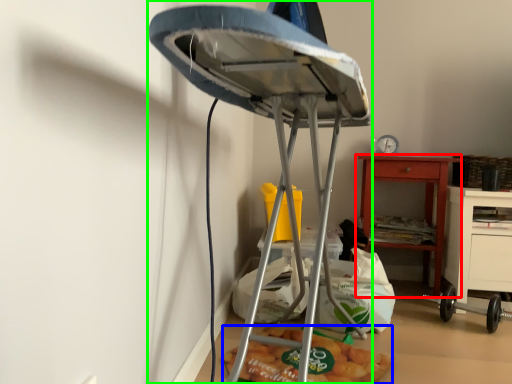
Question: Which is farther away from nightstand (highlighted by a red box)? food (highlighted by a blue box) or furniture (highlighted by a green box)?

Choices:
 (A) food
 (B) furniture

Answer: (B)